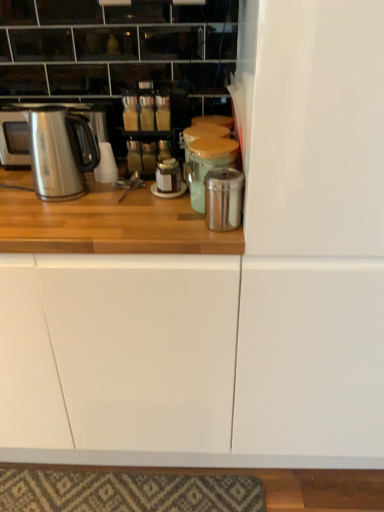
Question: From the image's perspective, relative to metallic silver canister at center, the second appliance from the front, is stainless steel kettle at left above or below?

Choices:
 (A) below
 (B) above

Answer: (B)

Question: Is stainless steel kettle at left to the left or to the right of metallic silver canister at center, the second appliance from the front, in the image?

Choices:
 (A) right
 (B) left

Answer: (B)

Question: Which object is positioned farthest from the stainless steel kettle at left?

Choices:
 (A) metallic silver canister at center, which is counted as the 1th appliance, starting from the back
 (B) metallic silver fridge at center-right
 (C) shiny metallic canister at center, the 2th appliance viewed from the back

Answer: (B)

Question: Estimate the real-world distances between objects in this image. Which object is closer to the shiny metallic canister at center, arranged as the first appliance when viewed from the front?

Choices:
 (A) stainless steel kettle at left
 (B) metallic silver canister at center, which is counted as the 1th appliance, starting from the back
 (C) metallic silver fridge at center-right

Answer: (B)